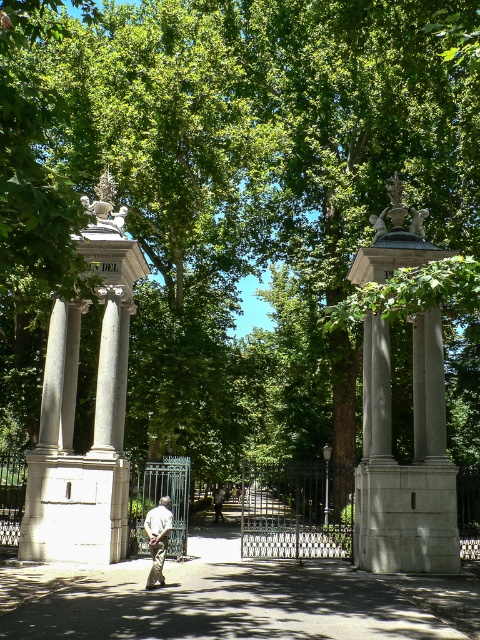
Question: Estimate the real-world distances between objects in this image. Which object is farther from the light brown leather jacket at center?

Choices:
 (A) camouflage fabric pants at center
 (B) gray stone column at left

Answer: (A)

Question: Does gray stone column at left have a greater width compared to camouflage fabric pants at center?

Choices:
 (A) yes
 (B) no

Answer: (B)

Question: Which point appears farthest from the camera in this image?

Choices:
 (A) (112, 509)
 (B) (219, 493)
 (C) (159, 566)

Answer: (B)

Question: Is camouflage fabric pants at center further to the viewer compared to light brown leather jacket at center?

Choices:
 (A) yes
 (B) no

Answer: (B)

Question: Which of these objects is positioned farthest from the camouflage fabric pants at center?

Choices:
 (A) light brown leather jacket at center
 (B) gray stone column at left

Answer: (A)

Question: Can you confirm if gray stone column at left is wider than light brown leather jacket at center?

Choices:
 (A) yes
 (B) no

Answer: (A)